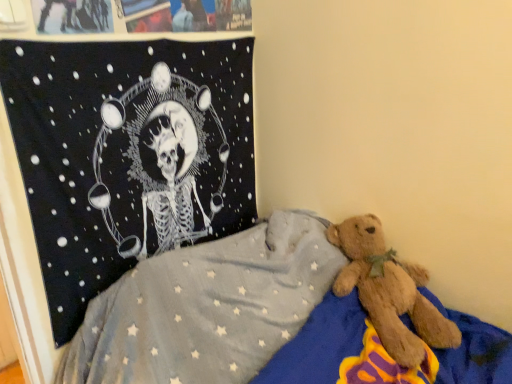
You are a GUI agent. You are given a task and a screenshot of the screen. Output one action in this format:
    pyautogui.click(x=<x>, y=<y>)
    Task: Click on the free space above black fabric tapestry at upper left (from a real-world perspective)
    
    Given the screenshot: What is the action you would take?
    pyautogui.click(x=151, y=36)